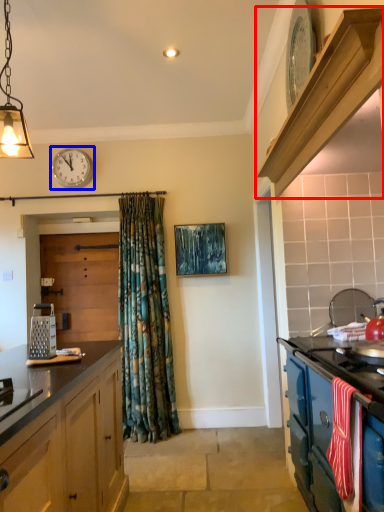
Question: Which object is closer to the camera taking this photo, shelf (highlighted by a red box) or clock (highlighted by a blue box)?

Choices:
 (A) shelf
 (B) clock

Answer: (A)